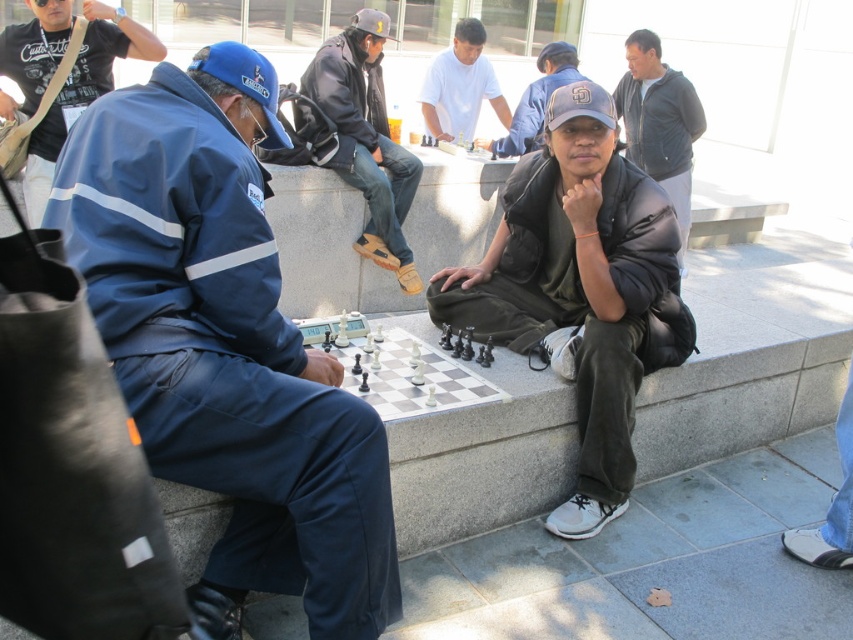
Is blue fabric jacket at left thinner than black matte jacket at center?

No.

Who is positioned more to the left, blue fabric jacket at left or black matte jacket at center?

Positioned to the left is blue fabric jacket at left.

Which is behind, point (210, 440) or point (646, 225)?

The point (646, 225) is behind.

Where is `blue fabric jacket at left`? The width and height of the screenshot is (853, 640). blue fabric jacket at left is located at coordinates (225, 344).

Is black matte jacket at center to the right of dark brown leather jacket at center from the viewer's perspective?

Correct, you'll find black matte jacket at center to the right of dark brown leather jacket at center.

Identify the location of black matte jacket at center. (575, 285).

Who is more forward, (498, 236) or (352, 29)?

Point (498, 236) is more forward.

Image resolution: width=853 pixels, height=640 pixels. In order to click on black matte jacket at center in this screenshot , I will do `click(575, 285)`.

Which is behind, point (108, 10) or point (473, 38)?

Point (473, 38)

Locate an element on the screen. dark blue uniform at left is located at coordinates (82, 92).